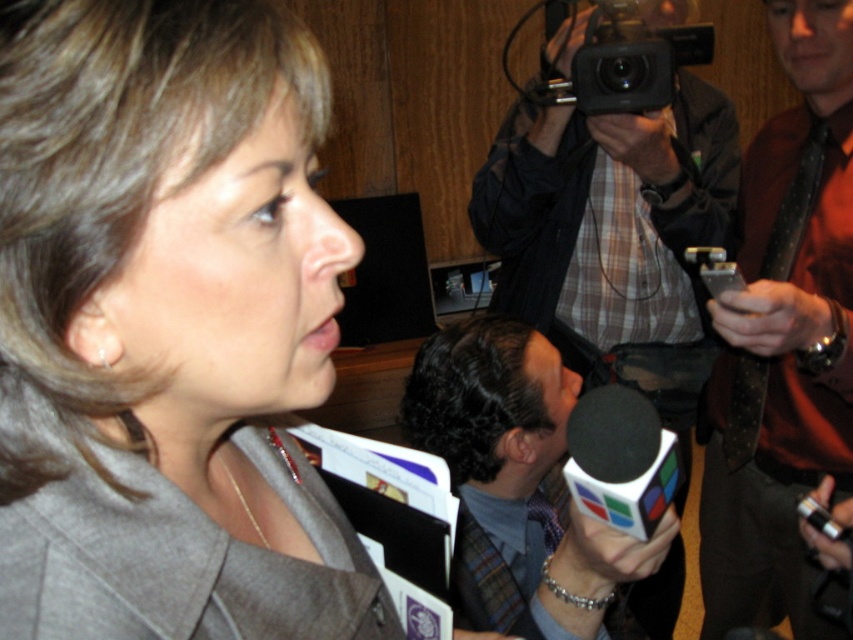
Question: Can you confirm if polka dot tie at right is smaller than plaid fabric tie at center?

Choices:
 (A) yes
 (B) no

Answer: (B)

Question: Based on their relative distances, which object is farther from the black plastic camera at upper center?

Choices:
 (A) plaid shirt at upper center
 (B) polka dot tie at right
 (C) plaid fabric tie at center

Answer: (C)

Question: Based on their relative distances, which object is nearer to the polka dot tie at right?

Choices:
 (A) black plastic camera at upper center
 (B) plaid shirt at upper center

Answer: (B)

Question: Among these points, which one is farthest from the camera?

Choices:
 (A) (808, 484)
 (B) (608, 58)

Answer: (A)

Question: Observing the image, what is the correct spatial positioning of polka dot tie at right in reference to black plastic camera at upper center?

Choices:
 (A) below
 (B) above

Answer: (A)

Question: Does plaid fabric tie at center have a greater width compared to black plastic camera at upper center?

Choices:
 (A) yes
 (B) no

Answer: (A)